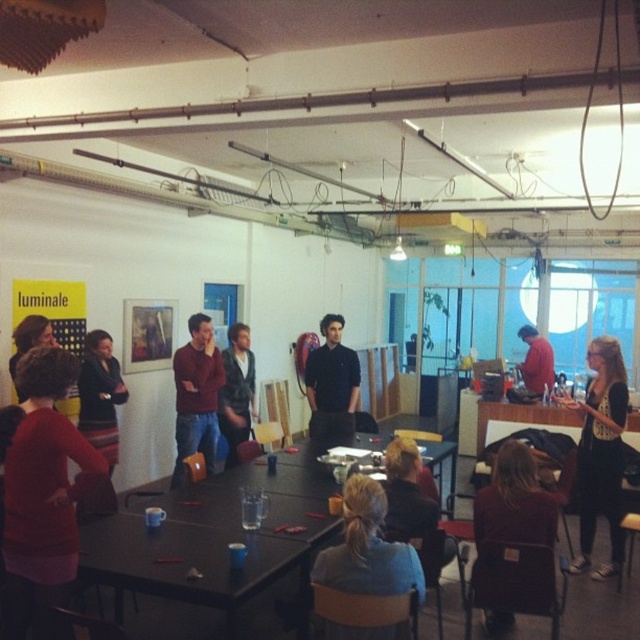
Does striped skirt at left have a greater height compared to wooden stool at lower right?

Yes, striped skirt at left is taller than wooden stool at lower right.

Is striped skirt at left positioned behind wooden stool at lower right?

That is True.

Identify the location of striped skirt at left. (100, 394).

The height and width of the screenshot is (640, 640). Find the location of `striped skirt at left`. striped skirt at left is located at coordinates (100, 394).

Between matte brown sweater at center and striped skirt at left, which one appears on the left side from the viewer's perspective?

From the viewer's perspective, striped skirt at left appears more on the left side.

Does matte brown sweater at center appear under striped skirt at left?

Correct, matte brown sweater at center is located below striped skirt at left.

Which is in front, point (188, 348) or point (81, 369)?

Point (81, 369) is in front.

At what (x,y) coordinates should I click in order to perform the action: click on matte brown sweater at center. Please return your answer as a coordinate pair (x, y). Image resolution: width=640 pixels, height=640 pixels. Looking at the image, I should click on (196, 396).

Is point (541, 387) closer to camera compared to point (10, 365)?

No, it is behind (10, 365).

Is matte red shirt at center above matte black jacket at left?

Incorrect, matte red shirt at center is not positioned above matte black jacket at left.

Who is more forward, (x=525, y=371) or (x=35, y=326)?

Positioned in front is point (x=35, y=326).

Find the location of `matte red shirt at center`. matte red shirt at center is located at coordinates (536, 362).